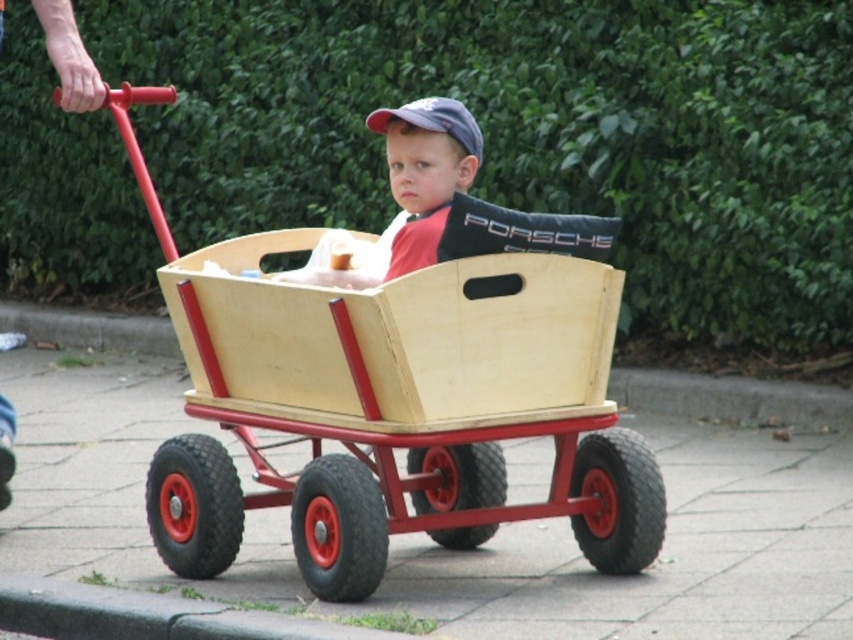
Between wooden wagon at center and matte wood wagon at center, which one appears on the right side from the viewer's perspective?

Positioned to the right is matte wood wagon at center.

Is wooden wagon at center below matte wood wagon at center?

Yes, wooden wagon at center is below matte wood wagon at center.

Between point (602, 560) and point (428, 132), which one is positioned behind?

Positioned behind is point (602, 560).

Where is `wooden wagon at center`? The width and height of the screenshot is (853, 640). wooden wagon at center is located at coordinates (399, 381).